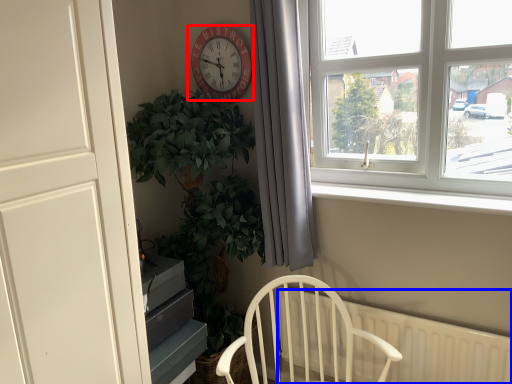
Question: Which object appears closest to the camera in this image, clock (highlighted by a red box) or radiator (highlighted by a blue box)?

Choices:
 (A) clock
 (B) radiator

Answer: (B)